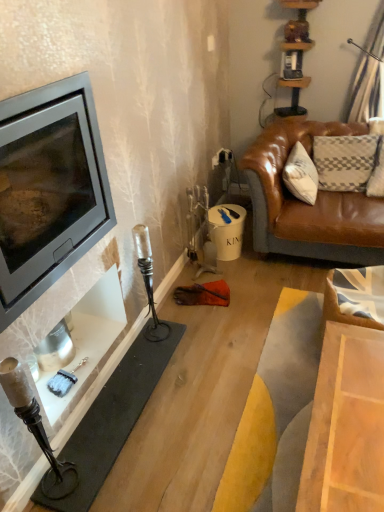
Question: Would you say matte black fireplace at left is outside matte black wood burning stove at left?

Choices:
 (A) yes
 (B) no

Answer: (A)

Question: From the image's perspective, is matte black fireplace at left located beneath matte black wood burning stove at left?

Choices:
 (A) yes
 (B) no

Answer: (A)

Question: Is matte black fireplace at left thinner than matte black wood burning stove at left?

Choices:
 (A) no
 (B) yes

Answer: (B)

Question: Can you confirm if matte black fireplace at left is taller than matte black wood burning stove at left?

Choices:
 (A) no
 (B) yes

Answer: (A)

Question: Is matte black fireplace at left aimed at matte black wood burning stove at left?

Choices:
 (A) yes
 (B) no

Answer: (B)

Question: Is matte black fireplace at left positioned in front of matte black wood burning stove at left?

Choices:
 (A) no
 (B) yes

Answer: (A)

Question: Would you say matte black wood burning stove at left is outside matte black fireplace at left?

Choices:
 (A) no
 (B) yes

Answer: (B)

Question: From the image's perspective, is matte black wood burning stove at left under matte black fireplace at left?

Choices:
 (A) no
 (B) yes

Answer: (A)

Question: Is matte black wood burning stove at left not near matte black fireplace at left?

Choices:
 (A) no
 (B) yes

Answer: (A)

Question: Is matte black wood burning stove at left in front of matte black fireplace at left?

Choices:
 (A) yes
 (B) no

Answer: (A)

Question: Is matte black wood burning stove at left thinner than matte black fireplace at left?

Choices:
 (A) no
 (B) yes

Answer: (A)

Question: Considering the relative sizes of matte black wood burning stove at left and matte black fireplace at left in the image provided, is matte black wood burning stove at left taller than matte black fireplace at left?

Choices:
 (A) no
 (B) yes

Answer: (B)

Question: Considering the positions of matte black wood burning stove at left and matte black fireplace at left in the image, is matte black wood burning stove at left bigger or smaller than matte black fireplace at left?

Choices:
 (A) big
 (B) small

Answer: (A)